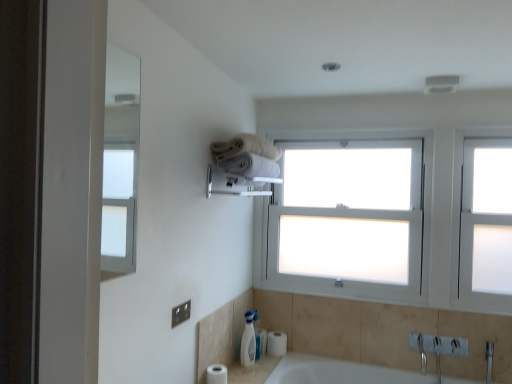
Question: Is frosted glass window at right at the left side of white cotton towel at upper center?

Choices:
 (A) yes
 (B) no

Answer: (B)

Question: Is white cotton towel at upper center at the back of frosted glass window at right?

Choices:
 (A) yes
 (B) no

Answer: (B)

Question: Is frosted glass window at right wider than white cotton towel at upper center?

Choices:
 (A) yes
 (B) no

Answer: (B)

Question: Is frosted glass window at right behind white cotton towel at upper center?

Choices:
 (A) no
 (B) yes

Answer: (B)

Question: Can we say frosted glass window at right lies outside white cotton towel at upper center?

Choices:
 (A) yes
 (B) no

Answer: (A)

Question: Is white cotton towel at upper center surrounded by frosted glass window at right?

Choices:
 (A) no
 (B) yes

Answer: (A)

Question: Is white matte toilet paper at lower left, which appears as the 2th toilet paper when viewed from the right, facing away from frosted glass window at right?

Choices:
 (A) no
 (B) yes

Answer: (A)

Question: Considering the relative sizes of white matte toilet paper at lower left, which appears as the 2th toilet paper when viewed from the right, and frosted glass window at right in the image provided, is white matte toilet paper at lower left, which appears as the 2th toilet paper when viewed from the right, shorter than frosted glass window at right?

Choices:
 (A) yes
 (B) no

Answer: (A)

Question: From the image's perspective, is white matte toilet paper at lower left, which is counted as the 1th toilet paper, starting from the left, above frosted glass window at right?

Choices:
 (A) yes
 (B) no

Answer: (B)

Question: Is white matte toilet paper at lower left, which is counted as the 1th toilet paper, starting from the left, smaller than frosted glass window at right?

Choices:
 (A) no
 (B) yes

Answer: (B)

Question: Considering the relative positions of white matte toilet paper at lower left, which is counted as the 1th toilet paper, starting from the left, and frosted glass window at right in the image provided, is white matte toilet paper at lower left, which is counted as the 1th toilet paper, starting from the left, to the right of frosted glass window at right from the viewer's perspective?

Choices:
 (A) no
 (B) yes

Answer: (A)

Question: Would you consider white matte toilet paper at lower left, the 2th toilet paper viewed from the back, to be distant from frosted glass window at right?

Choices:
 (A) no
 (B) yes

Answer: (B)

Question: Is white matte toilet paper at lower left, which is counted as the 1th toilet paper, starting from the left, bigger than white ceramic sink at lower right?

Choices:
 (A) yes
 (B) no

Answer: (B)